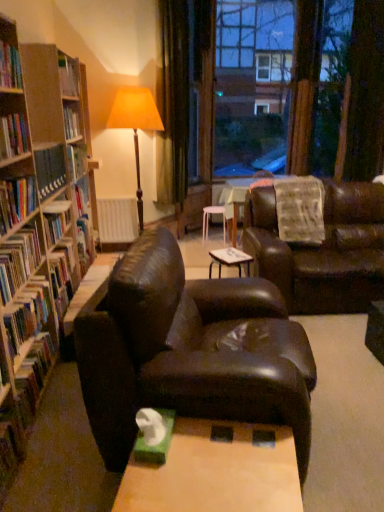
I want to click on hardcover book at left, arranged as the second book when ordered from the bottom, so click(19, 259).

The width and height of the screenshot is (384, 512). Describe the element at coordinates (19, 259) in the screenshot. I see `hardcover book at left, arranged as the second book when ordered from the bottom` at that location.

The image size is (384, 512). What do you see at coordinates (117, 220) in the screenshot?
I see `white matte radiator at center` at bounding box center [117, 220].

Identify the location of wooden table at center. This screenshot has height=512, width=384. (217, 471).

What do you see at coordinates (173, 102) in the screenshot?
I see `green velvet curtain at upper center` at bounding box center [173, 102].

What do you see at coordinates (14, 135) in the screenshot? I see `hardcover book at left, which appears as the 2th book when viewed from the top` at bounding box center [14, 135].

What do you see at coordinates (189, 351) in the screenshot? I see `matte brown leather couch at center, which is counted as the first studio couch, starting from the left` at bounding box center [189, 351].

Identify the location of hardcover book at left, which ranks as the fourth book in bottom-to-top order. The width and height of the screenshot is (384, 512). (50, 170).

Is hardcover book at left, the 1th book from the bottom, taller than wooden table at center?

In fact, hardcover book at left, the 1th book from the bottom, may be shorter than wooden table at center.

Which object is further away from the camera, hardcover book at left, the 1th book from the bottom, or wooden table at center?

Positioned behind is hardcover book at left, the 1th book from the bottom.

Does hardcover book at left, the 6th book from the top, have a greater width compared to wooden table at center?

In fact, hardcover book at left, the 6th book from the top, might be narrower than wooden table at center.

Is hardcover book at left, the 6th book from the top, not close to wooden table at center?

Yes.

Considering the positions of objects hardcover book at left, the 1th book from the bottom, and hardcover book at left, the sixth book when ordered from bottom to top, in the image provided, who is in front, hardcover book at left, the 1th book from the bottom, or hardcover book at left, the sixth book when ordered from bottom to top,?

hardcover book at left, the sixth book when ordered from bottom to top, is closer to the camera.

Which is farther from the camera, (46,312) or (2,84)?

Point (46,312)

From a real-world perspective, starting from the hardcover book at left, the 1th book from the bottom, which book is the 5th one vertically above it? Please provide its 2D coordinates.

[(10, 67)]

Considering the relative sizes of hardcover book at left, the 6th book from the top, and hardcover book at left, the sixth book when ordered from bottom to top, in the image provided, is hardcover book at left, the 6th book from the top, thinner than hardcover book at left, the sixth book when ordered from bottom to top,?

No, hardcover book at left, the 6th book from the top, is not thinner than hardcover book at left, the sixth book when ordered from bottom to top.

Is matte brown floor lamp at center inside or outside of hardcover book at left, which ranks as the fourth book in bottom-to-top order?

matte brown floor lamp at center is located beyond the bounds of hardcover book at left, which ranks as the fourth book in bottom-to-top order.

Does matte brown floor lamp at center turn towards hardcover book at left, which ranks as the 3th book in top-to-bottom order?

No, matte brown floor lamp at center does not turn towards hardcover book at left, which ranks as the 3th book in top-to-bottom order.

From the image's perspective, between matte brown floor lamp at center and hardcover book at left, which ranks as the 3th book in top-to-bottom order, who is located below?

From the image's view, hardcover book at left, which ranks as the 3th book in top-to-bottom order, is below.

Is matte brown floor lamp at center far from hardcover book at left, which ranks as the 3th book in top-to-bottom order?

matte brown floor lamp at center is positioned a significant distance from hardcover book at left, which ranks as the 3th book in top-to-bottom order.

From the image's perspective, which is below, green matte tissue box at lower center or hardcover book at left, which ranks as the fourth book in bottom-to-top order?

green matte tissue box at lower center.

From a real-world perspective, between green matte tissue box at lower center and hardcover book at left, which ranks as the fourth book in bottom-to-top order, who is vertically higher?

hardcover book at left, which ranks as the fourth book in bottom-to-top order, is physically above.

Which is more to the right, green matte tissue box at lower center or hardcover book at left, which ranks as the fourth book in bottom-to-top order?

green matte tissue box at lower center.

From their relative heights in the image, would you say green matte tissue box at lower center is taller or shorter than hardcover book at left, which ranks as the fourth book in bottom-to-top order?

Considering their sizes, green matte tissue box at lower center has less height than hardcover book at left, which ranks as the fourth book in bottom-to-top order.

Which of these two, hardcover book at left, the third book positioned from the bottom, or hardcover book at left, which appears as the 2th book when viewed from the top, is thinner?

Thinner between the two is hardcover book at left, which appears as the 2th book when viewed from the top.

Is hardcover book at left, the third book positioned from the bottom, oriented away from hardcover book at left, which appears as the 2th book when viewed from the top?

hardcover book at left, the third book positioned from the bottom, does not have its back to hardcover book at left, which appears as the 2th book when viewed from the top.

What's the angular difference between hardcover book at left, which is counted as the fourth book, starting from the top, and hardcover book at left, which appears as the 2th book when viewed from the top,'s facing directions?

The angular difference between hardcover book at left, which is counted as the fourth book, starting from the top, and hardcover book at left, which appears as the 2th book when viewed from the top, is 0.000591 degrees.

From the image's perspective, is hardcover book at left, which is counted as the fourth book, starting from the top, located above or below hardcover book at left, which appears as the 2th book when viewed from the top?

hardcover book at left, which is counted as the fourth book, starting from the top, is below hardcover book at left, which appears as the 2th book when viewed from the top.

Is hardcover book at left, the sixth book when ordered from bottom to top, wider or thinner than hardcover book at left, the 6th book from the top?

In the image, hardcover book at left, the sixth book when ordered from bottom to top, appears to be more narrow than hardcover book at left, the 6th book from the top.

From a real-world perspective, which is physically above, hardcover book at left, acting as the 1th book starting from the top, or hardcover book at left, the 6th book from the top?

From a 3D spatial view, hardcover book at left, acting as the 1th book starting from the top, is above.

Measure the distance from hardcover book at left, acting as the 1th book starting from the top, to hardcover book at left, the 1th book from the bottom.

1.09 meters.

Can hardcover book at left, the 1th book from the bottom, be found inside hardcover book at left, the sixth book when ordered from bottom to top?

Definitely not — hardcover book at left, the 1th book from the bottom, is not inside hardcover book at left, the sixth book when ordered from bottom to top.

Does point (16, 340) lie behind point (255, 17)?

No, (16, 340) is in front of (255, 17).

Is hardcover book at left, the 6th book from the top, taller than transparent glass window at center?

Incorrect, the height of hardcover book at left, the 6th book from the top, is not larger of that of transparent glass window at center.

Considering their positions, is hardcover book at left, the 6th book from the top, located in front of or behind transparent glass window at center?

In the image, hardcover book at left, the 6th book from the top, appears in front of transparent glass window at center.

Looking at this image, can you confirm if hardcover book at left, the 6th book from the top, is thinner than transparent glass window at center?

Yes.

Where is `table below the hardcover book at left, the 6th book from the top (from the image's perspective)`? table below the hardcover book at left, the 6th book from the top (from the image's perspective) is located at coordinates (217, 471).

Starting from the hardcover book at left, the sixth book when ordered from bottom to top, which book is the 1st one behind? Please provide its 2D coordinates.

[(28, 313)]

Estimate the real-world distances between objects in this image. Which object is further from hardcover book at left, acting as the 1th book starting from the top, wooden table at center or green matte tissue box at lower center?

wooden table at center lies further to hardcover book at left, acting as the 1th book starting from the top, than the other object.

From the image, which object appears to be nearer to hardcover book at left, the third book positioned from the bottom, hardcover book at left, which appears as the 2th book when viewed from the top, or white matte radiator at center?

hardcover book at left, which appears as the 2th book when viewed from the top, is closer to hardcover book at left, the third book positioned from the bottom.

Which object lies nearer to the anchor point hardcover book at left, the 6th book from the top, white plastic stool at center or hardcover book at left, acting as the 1th book starting from the top?

hardcover book at left, acting as the 1th book starting from the top, lies closer to hardcover book at left, the 6th book from the top, than the other object.

Considering their positions, is transparent glass window at center positioned further to hardcover book at left, the 6th book from the top, than hardcover book at left, acting as the 1th book starting from the top?

transparent glass window at center is positioned further to the anchor hardcover book at left, the 6th book from the top.

Based on their spatial positions, is green matte tissue box at lower center or hardcover book at left, arranged as the second book when ordered from the bottom, closer to white plastic stool at center?

hardcover book at left, arranged as the second book when ordered from the bottom, lies closer to white plastic stool at center than the other object.

Based on their spatial positions, is matte brown floor lamp at center or transparent glass window at center closer to hardcover book at left, the third book positioned from the bottom?

The object closer to hardcover book at left, the third book positioned from the bottom, is matte brown floor lamp at center.

Based on their spatial positions, is white matte radiator at center or hardcover book at left, the third book positioned from the bottom, closer to hardcover book at left, the 5th book ordered from the bottom?

hardcover book at left, the third book positioned from the bottom, is positioned closer to the anchor hardcover book at left, the 5th book ordered from the bottom.

Based on their spatial positions, is wooden table at center or matte brown floor lamp at center further from white matte radiator at center?

Based on the image, wooden table at center appears to be further to white matte radiator at center.

You are a GUI agent. You are given a task and a screenshot of the screen. Output one action in this format:
    pyautogui.click(x=<x>, y=<y>)
    Task: Click on the paperback book between hardcover book at left, arranged as the second book when ordered from the bottom, and matte brown leather couch at center, arranged as the 2th studio couch when viewed from the right, in the horizontal direction
    Image resolution: width=384 pixels, height=512 pixels.
    Given the screenshot: What is the action you would take?
    pyautogui.click(x=158, y=444)

You are a GUI agent. You are given a task and a screenshot of the screen. Output one action in this format:
    pyautogui.click(x=<x>, y=<y>)
    Task: Click on the paperback book situated between hardcover book at left, the fifth book positioned from the top, and leather couch at center, the second studio couch when ordered from front to back, from left to right
    
    Given the screenshot: What is the action you would take?
    pyautogui.click(x=158, y=444)

Image resolution: width=384 pixels, height=512 pixels. Find the location of `studio couch located between hardcover book at left, which appears as the 2th book when viewed from the top, and white matte radiator at center in the depth direction`. studio couch located between hardcover book at left, which appears as the 2th book when viewed from the top, and white matte radiator at center in the depth direction is located at coordinates [x=322, y=250].

This screenshot has width=384, height=512. In order to click on radiator between hardcover book at left, the third book positioned from the bottom, and transparent glass window at center in the front-back direction in this screenshot , I will do `click(117, 220)`.